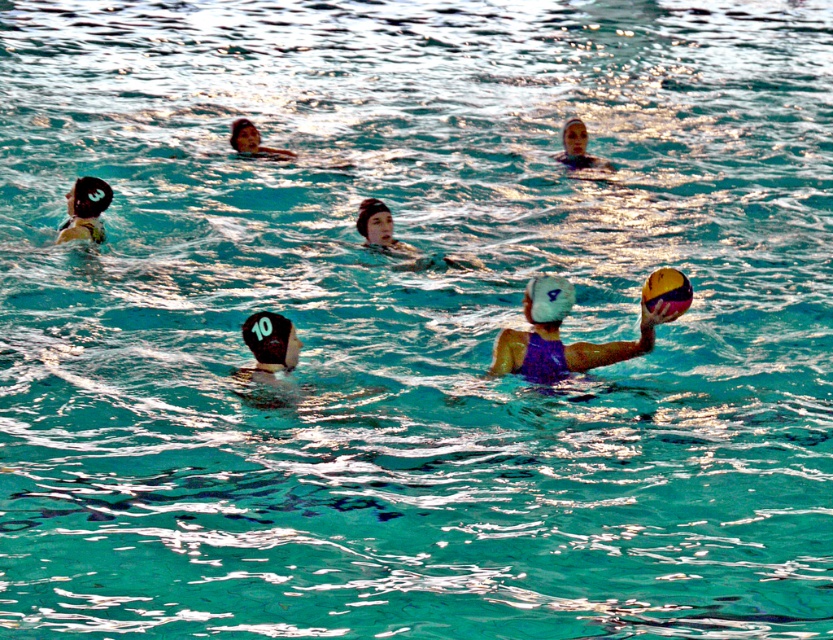
Question: Which object is farther from the camera taking this photo?

Choices:
 (A) matte black swim cap at center
 (B) matte black swim cap at upper center

Answer: (B)

Question: Can you confirm if white matte swim cap at center is positioned below matte black swim cap at upper center?

Choices:
 (A) yes
 (B) no

Answer: (A)

Question: Observing the image, what is the correct spatial positioning of purple matte swimsuit at center in reference to yellow rubber swim cap at upper right?

Choices:
 (A) above
 (B) below

Answer: (B)

Question: Which object is farther from the camera taking this photo?

Choices:
 (A) matte black swim cap at center
 (B) white matte swim cap at center
 (C) black matte swim cap at center
 (D) matte black swim cap at left

Answer: (D)

Question: Is purple matte swimsuit at center below yellow rubber swim cap at upper right?

Choices:
 (A) no
 (B) yes

Answer: (B)

Question: Which of the following is the closest to the observer?

Choices:
 (A) (532, 326)
 (B) (272, 317)

Answer: (B)